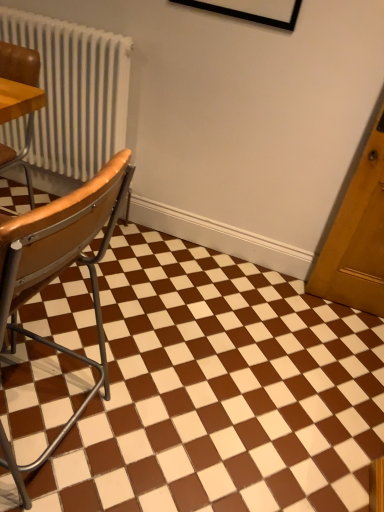
The height and width of the screenshot is (512, 384). Identify the location of wooden seat at left, marked as the 2th chair in a top-to-bottom arrangement. (58, 272).

This screenshot has width=384, height=512. Describe the element at coordinates (19, 64) in the screenshot. I see `leather seat at left, which is the first chair in top-to-bottom order` at that location.

The width and height of the screenshot is (384, 512). Identify the location of leather seat at left, which appears as the 2th chair when ordered from the bottom. (19, 64).

The height and width of the screenshot is (512, 384). What are the coordinates of `brown glossy tile at center` in the screenshot? It's located at (220, 391).

How different are the orientations of wooden seat at left, marked as the 2th chair in a top-to-bottom arrangement, and leather seat at left, which appears as the 2th chair when ordered from the bottom, in degrees?

There is a 91-degree angle between the facing directions of wooden seat at left, marked as the 2th chair in a top-to-bottom arrangement, and leather seat at left, which appears as the 2th chair when ordered from the bottom.

Does wooden seat at left, marked as the 2th chair in a top-to-bottom arrangement, appear on the left side of leather seat at left, which appears as the 2th chair when ordered from the bottom?

No, wooden seat at left, marked as the 2th chair in a top-to-bottom arrangement, is not to the left of leather seat at left, which appears as the 2th chair when ordered from the bottom.

Does wooden seat at left, marked as the 2th chair in a top-to-bottom arrangement, lie behind leather seat at left, which is the first chair in top-to-bottom order?

No, it is not.

Considering the positions of points (10, 469) and (30, 183), is point (10, 469) closer to camera compared to point (30, 183)?

That is True.

Which is less distant, (4, 316) or (136, 436)?

Positioned in front is point (4, 316).

Between wooden seat at left, positioned as the 1th chair in bottom-to-top order, and brown glossy tile at center, which one is positioned behind?

brown glossy tile at center is behind.

How far apart are wooden seat at left, marked as the 2th chair in a top-to-bottom arrangement, and brown glossy tile at center?

wooden seat at left, marked as the 2th chair in a top-to-bottom arrangement, and brown glossy tile at center are 46.39 centimeters apart.

Locate an element on the screen. This screenshot has height=512, width=384. square below the wooden seat at left, positioned as the 1th chair in bottom-to-top order (from a real-world perspective) is located at coordinates (220, 391).

From the image's perspective, is brown glossy tile at center on wooden seat at left, positioned as the 1th chair in bottom-to-top order?

No, from the image's perspective, brown glossy tile at center is not over wooden seat at left, positioned as the 1th chair in bottom-to-top order.

Is brown glossy tile at center surrounding wooden seat at left, marked as the 2th chair in a top-to-bottom arrangement?

No.

Between point (48, 362) and point (18, 55), which one is positioned behind?

The point (48, 362) is farther.

From a real-world perspective, who is located higher, brown glossy tile at center or leather seat at left, which is the first chair in top-to-bottom order?

In real-world perspective, leather seat at left, which is the first chair in top-to-bottom order, is above.

Could you tell me if brown glossy tile at center is turned towards leather seat at left, which appears as the 2th chair when ordered from the bottom?

No.

Is leather seat at left, which is the first chair in top-to-bottom order, in front of wooden seat at left, marked as the 2th chair in a top-to-bottom arrangement?

That is False.

Is leather seat at left, which is the first chair in top-to-bottom order, touching wooden seat at left, marked as the 2th chair in a top-to-bottom arrangement?

There is a gap between leather seat at left, which is the first chair in top-to-bottom order, and wooden seat at left, marked as the 2th chair in a top-to-bottom arrangement.

Is leather seat at left, which is the first chair in top-to-bottom order, taller or shorter than wooden seat at left, positioned as the 1th chair in bottom-to-top order?

leather seat at left, which is the first chair in top-to-bottom order, is shorter than wooden seat at left, positioned as the 1th chair in bottom-to-top order.

The height and width of the screenshot is (512, 384). What are the coordinates of `chair behind the brown glossy tile at center` in the screenshot? It's located at (19, 64).

From a real-world perspective, is leather seat at left, which appears as the 2th chair when ordered from the bottom, under brown glossy tile at center?

No, from a real-world perspective, leather seat at left, which appears as the 2th chair when ordered from the bottom, is not under brown glossy tile at center.

From the image's perspective, which one is positioned lower, leather seat at left, which appears as the 2th chair when ordered from the bottom, or brown glossy tile at center?

From the image's view, brown glossy tile at center is below.

Does leather seat at left, which is the first chair in top-to-bottom order, have a lesser height compared to brown glossy tile at center?

No, leather seat at left, which is the first chair in top-to-bottom order, is not shorter than brown glossy tile at center.

Image resolution: width=384 pixels, height=512 pixels. Identify the location of chair below the leather seat at left, which appears as the 2th chair when ordered from the bottom (from a real-world perspective). (58, 272).

Locate an element on the screen. The height and width of the screenshot is (512, 384). the 1st chair located above the brown glossy tile at center (from a real-world perspective) is located at coordinates click(x=58, y=272).

Looking at the image, which one is located closer to leather seat at left, which is the first chair in top-to-bottom order, brown glossy tile at center or wooden seat at left, positioned as the 1th chair in bottom-to-top order?

wooden seat at left, positioned as the 1th chair in bottom-to-top order, lies closer to leather seat at left, which is the first chair in top-to-bottom order, than the other object.

Which object lies further to the anchor point wooden seat at left, marked as the 2th chair in a top-to-bottom arrangement, leather seat at left, which is the first chair in top-to-bottom order, or brown glossy tile at center?

leather seat at left, which is the first chair in top-to-bottom order, is further to wooden seat at left, marked as the 2th chair in a top-to-bottom arrangement.

From the image, which object appears to be nearer to wooden seat at left, positioned as the 1th chair in bottom-to-top order, brown glossy tile at center or leather seat at left, which is the first chair in top-to-bottom order?

The object closer to wooden seat at left, positioned as the 1th chair in bottom-to-top order, is brown glossy tile at center.

From the image, which object appears to be nearer to brown glossy tile at center, wooden seat at left, marked as the 2th chair in a top-to-bottom arrangement, or leather seat at left, which is the first chair in top-to-bottom order?

wooden seat at left, marked as the 2th chair in a top-to-bottom arrangement, lies closer to brown glossy tile at center than the other object.

Considering their positions, is leather seat at left, which is the first chair in top-to-bottom order, positioned further to brown glossy tile at center than wooden seat at left, positioned as the 1th chair in bottom-to-top order?

leather seat at left, which is the first chair in top-to-bottom order, is positioned further to the anchor brown glossy tile at center.

Which object lies nearer to the anchor point leather seat at left, which is the first chair in top-to-bottom order, wooden seat at left, marked as the 2th chair in a top-to-bottom arrangement, or brown glossy tile at center?

wooden seat at left, marked as the 2th chair in a top-to-bottom arrangement, is closer to leather seat at left, which is the first chair in top-to-bottom order.

Identify the location of chair between leather seat at left, which is the first chair in top-to-bottom order, and brown glossy tile at center in the up-down direction. This screenshot has width=384, height=512. (58, 272).